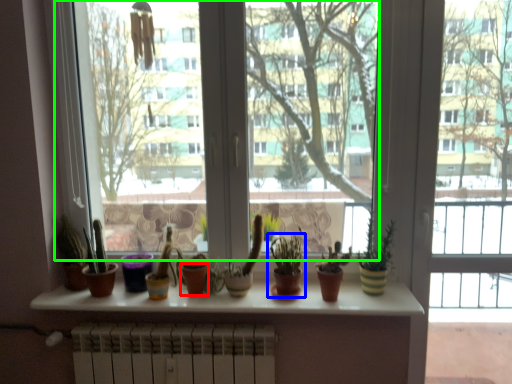
Question: Considering the real-world distances, which object is farthest from flowerpot (highlighted by a red box)? houseplant (highlighted by a blue box) or window screen (highlighted by a green box)?

Choices:
 (A) houseplant
 (B) window screen

Answer: (B)